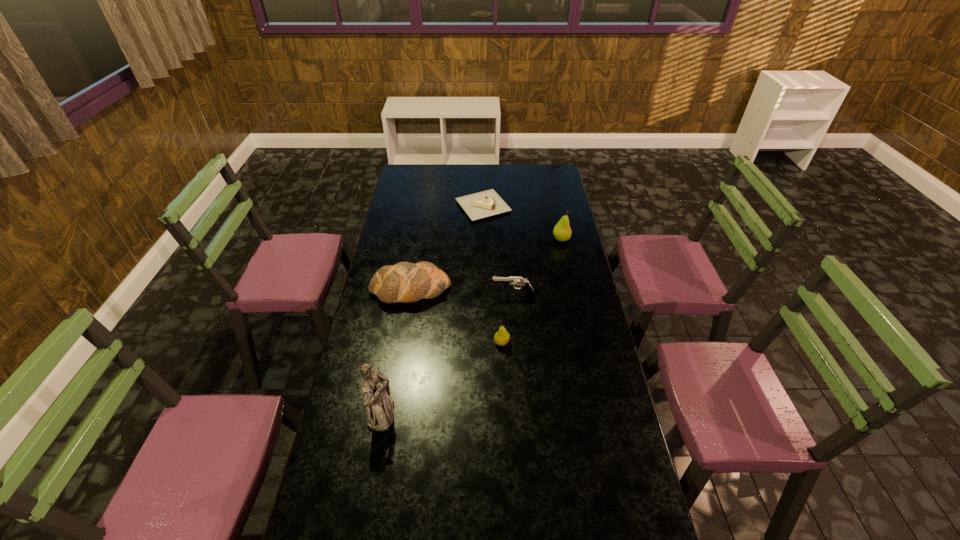
You are a GUI agent. You are given a task and a screenshot of the screen. Output one action in this format:
    pyautogui.click(x=<x>, y=<y>)
    Task: Click on the free space between the shortest object and the nearer pear
    The width and height of the screenshot is (960, 540).
    Given the screenshot: What is the action you would take?
    pyautogui.click(x=492, y=275)

Locate an element on the screen. This screenshot has width=960, height=540. vacant area that lies between the bread and the gun is located at coordinates (462, 292).

Locate an element on the screen. free space between the shortest object and the nearest object is located at coordinates (432, 310).

You are a GUI agent. You are given a task and a screenshot of the screen. Output one action in this format:
    pyautogui.click(x=<x>, y=<y>)
    Task: Click on the unoccupied area between the nearest object and the bread
    
    Given the screenshot: What is the action you would take?
    pyautogui.click(x=396, y=352)

Where is `free space between the gun and the nearest object`? The image size is (960, 540). free space between the gun and the nearest object is located at coordinates (447, 354).

Choose which object is the fifth nearest neighbor to the farthest object. Please provide its 2D coordinates. Your answer should be formatted as a tuple, i.e. [(x, y)], where the tuple contains the x and y coordinates of a point satisfying the conditions above.

[(379, 405)]

This screenshot has width=960, height=540. Identify the location of object that is the third closest to the second nearest object. (379, 405).

Identify the location of vacant area that satisfies the following two spatial constraints: 1. at the muzzle of the gun; 2. on the front side of the nearer pear. (516, 342).